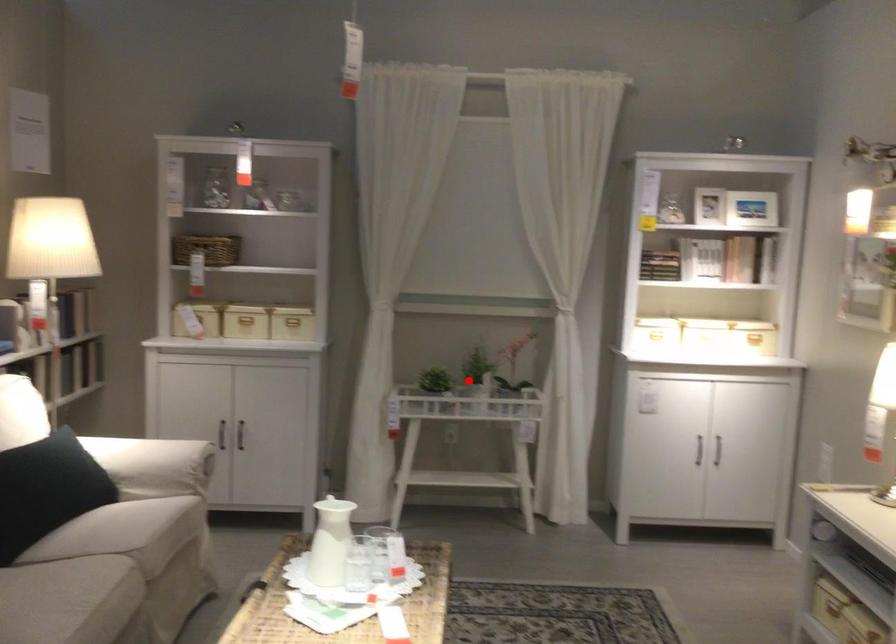
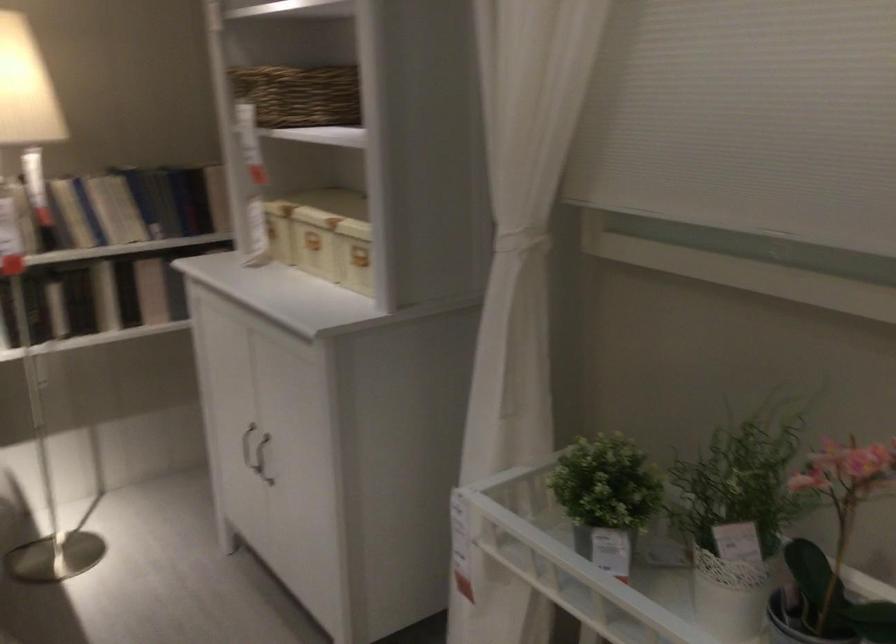
Locate, in the second image, the point that corresponds to the highlighted location in the first image.

(606, 498)